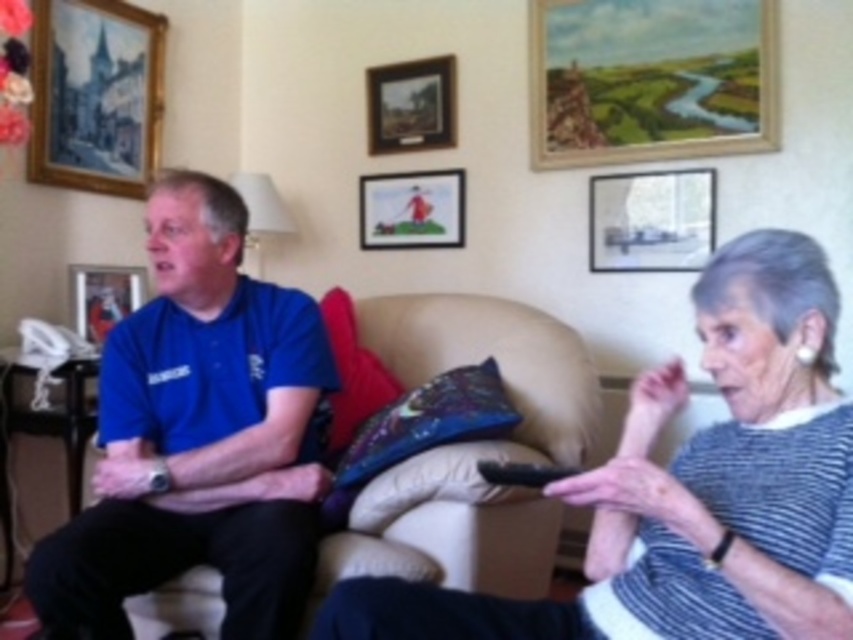
Measure the distance between wooden framed landscape painting at upper center and matte plastic picture frame at upper center.

The distance of wooden framed landscape painting at upper center from matte plastic picture frame at upper center is 58.18 centimeters.

Who is more forward, (682, 10) or (426, 202)?

Point (682, 10) is more forward.

Locate an element on the screen. wooden framed landscape painting at upper center is located at coordinates (650, 80).

Which of these two, wooden framed landscape painting at upper center or velvet-like blue pillow at center, stands taller?

With more height is wooden framed landscape painting at upper center.

Is point (699, 99) positioned behind point (476, 378)?

Yes.

Locate an element on the screen. The height and width of the screenshot is (640, 853). wooden framed landscape painting at upper center is located at coordinates pyautogui.click(x=650, y=80).

Describe the element at coordinates (410, 209) in the screenshot. This screenshot has height=640, width=853. I see `matte plastic picture frame at upper center` at that location.

Which is more to the right, matte plastic picture frame at upper center or wooden framed picture at center?

matte plastic picture frame at upper center is more to the right.

Is point (370, 212) more distant than point (387, 141)?

Yes.

Where is `matte plastic picture frame at upper center`? The image size is (853, 640). matte plastic picture frame at upper center is located at coordinates (410, 209).